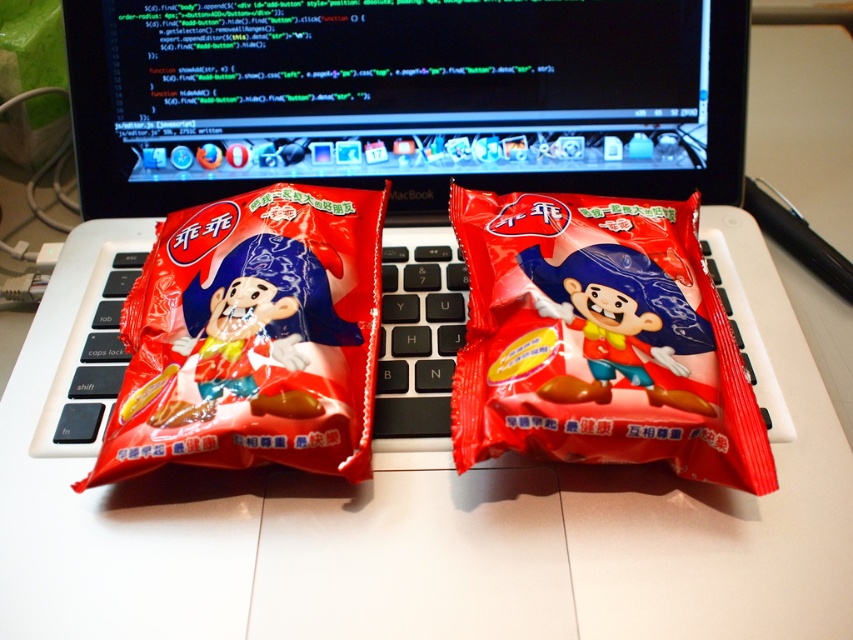
Who is taller, matte black laptop at center or matte plastic snack at center?

matte black laptop at center

Measure the distance between matte black laptop at center and camera.

matte black laptop at center and camera are 22.61 inches apart from each other.

This screenshot has width=853, height=640. Find the location of `matte black laptop at center`. matte black laptop at center is located at coordinates (383, 141).

Is matte black laptop at center above black plastic keyboard at center?

Correct, matte black laptop at center is located above black plastic keyboard at center.

Where is `matte black laptop at center`? This screenshot has width=853, height=640. matte black laptop at center is located at coordinates (383, 141).

Where is `matte black laptop at center`? The width and height of the screenshot is (853, 640). matte black laptop at center is located at coordinates (383, 141).

Based on the photo, between matte black laptop at center and matte plastic snack at left, which one appears on the right side from the viewer's perspective?

From the viewer's perspective, matte black laptop at center appears more on the right side.

Which is above, matte black laptop at center or matte plastic snack at left?

Positioned higher is matte black laptop at center.

Between point (543, 134) and point (328, 326), which one is positioned in front?

Point (328, 326) is in front.

Locate an element on the screen. Image resolution: width=853 pixels, height=640 pixels. matte black laptop at center is located at coordinates (383, 141).